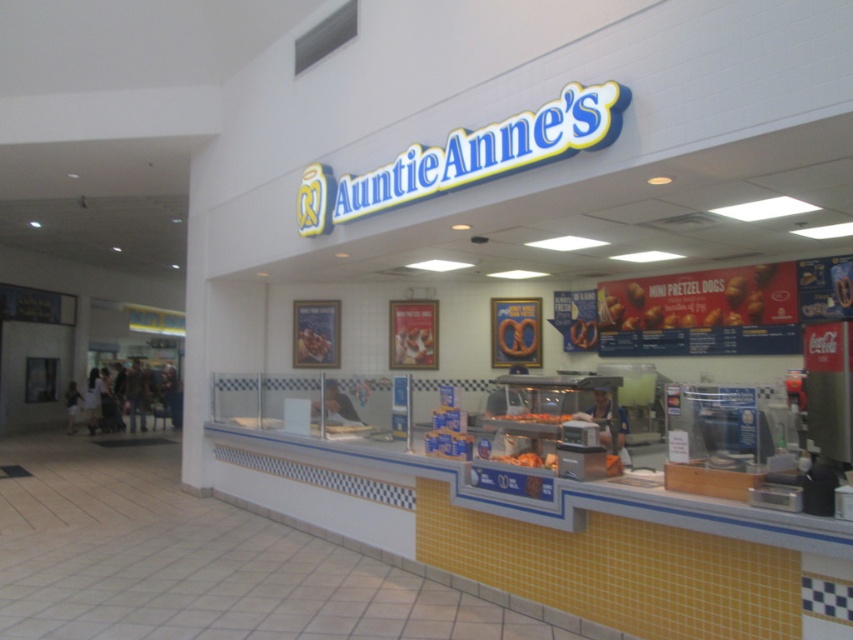
You are a customer at Auntie Anne and want to choose between the golden crispy pretzel dogs at center and the orange crispy pretzel at center. Which one is wider?

The golden crispy pretzel dogs at center is wider than the orange crispy pretzel at center.

You are a customer at Auntie Anne looking to order a snack. You see two items at the center of the counter, the golden crispy pretzel dogs at center and the golden crispy pretzel at center. Which one is closer to you?

The golden crispy pretzel dogs at center is closer to you because the golden crispy pretzel at center is behind it.